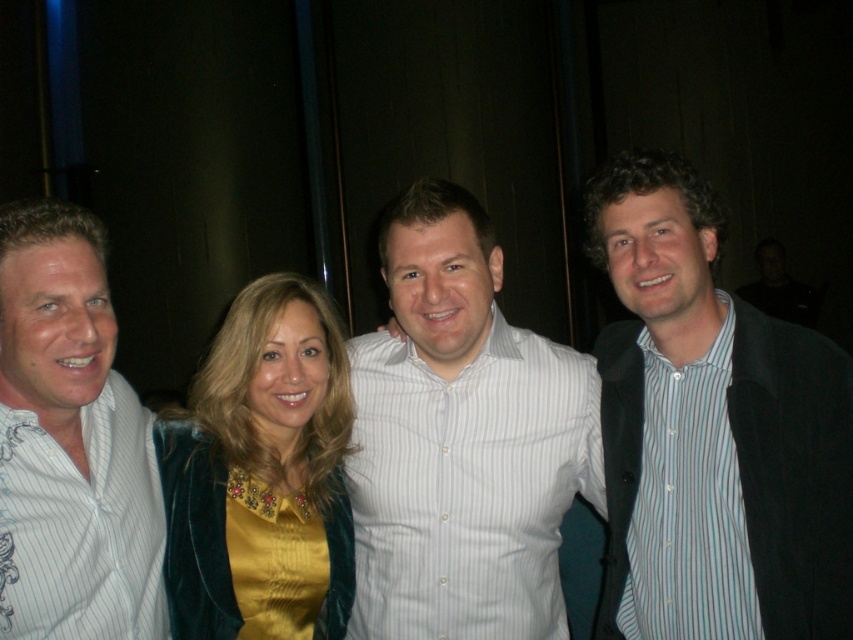
Between white striped shirt at left and velvet/golden-yellow blouse at center, which one has more height?

white striped shirt at left is taller.

Can you confirm if white striped shirt at left is positioned to the left of velvet/golden-yellow blouse at center?

Indeed, white striped shirt at left is positioned on the left side of velvet/golden-yellow blouse at center.

Image resolution: width=853 pixels, height=640 pixels. What do you see at coordinates (70, 442) in the screenshot?
I see `white striped shirt at left` at bounding box center [70, 442].

At what (x,y) coordinates should I click in order to perform the action: click on white striped shirt at left. Please return your answer as a coordinate pair (x, y). Looking at the image, I should click on (70, 442).

Does white striped shirt at center appear over velvet/golden-yellow blouse at center?

Yes, white striped shirt at center is above velvet/golden-yellow blouse at center.

What do you see at coordinates (462, 440) in the screenshot? I see `white striped shirt at center` at bounding box center [462, 440].

Who is more forward, (x=498, y=596) or (x=314, y=552)?

Point (x=314, y=552) is in front.

Locate an element on the screen. The width and height of the screenshot is (853, 640). white striped shirt at center is located at coordinates (462, 440).

Is striped cotton shirt at center closer to the viewer compared to velvet/golden-yellow blouse at center?

Yes, striped cotton shirt at center is closer to the viewer.

Which is behind, point (804, 422) or point (228, 308)?

The point (228, 308) is behind.

At what (x,y) coordinates should I click in order to perform the action: click on striped cotton shirt at center. Please return your answer as a coordinate pair (x, y). This screenshot has height=640, width=853. Looking at the image, I should click on (712, 429).